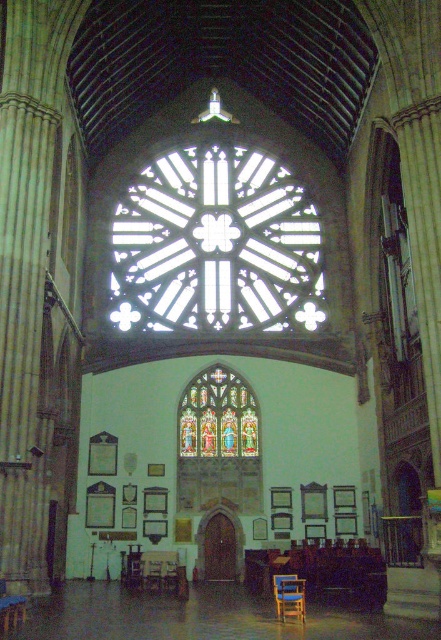
You are a visitor standing at the entrance of the cathedral and want to take a photo of the clear glass rose window at center and the wooden chair at lower center. Which object should you focus on first if you want to capture both in a single frame without moving your camera?

You should focus on the clear glass rose window at center first because it is positioned on the left side of the wooden chair at lower center, so by centering your camera on the left side, you can include both objects in the frame.

You are standing in the cathedral and want to take a photo of the wooden chair at lower center. To ensure the stained glass window at center appears in the background, should you position yourself to the left or right of the chair?

You should position yourself to the right of the wooden chair at lower center. Since the stained glass window at center is to the left of the wooden chair at lower center, placing yourself to the right of the chair will allow the window to be visible behind it in the photo.